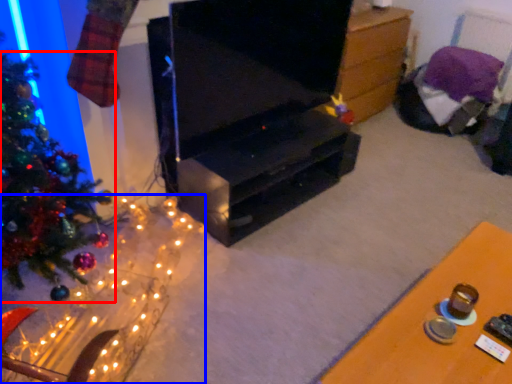
Question: Which object is further to the camera taking this photo, christmas tree (highlighted by a red box) or christmas decoration (highlighted by a blue box)?

Choices:
 (A) christmas tree
 (B) christmas decoration

Answer: (A)